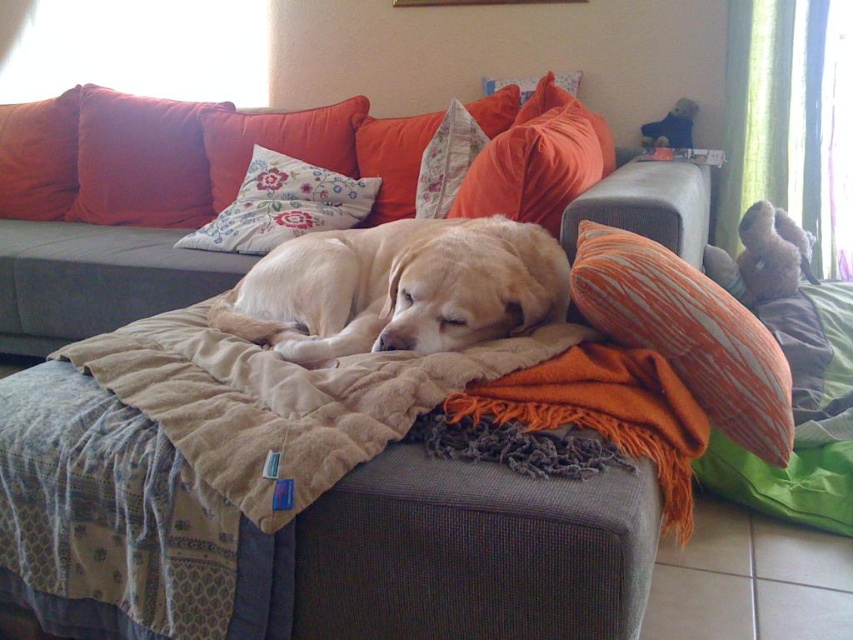
Does beige soft blanket at center have a larger size compared to floral fabric pillow at upper center?

Yes.

Does beige soft blanket at center have a greater width compared to floral fabric pillow at upper center?

Yes.

Is point (206, 403) more distant than point (426, 131)?

No, (206, 403) is closer to viewer.

Find the location of a particular element. The width and height of the screenshot is (853, 640). beige soft blanket at center is located at coordinates (283, 401).

Is floral fabric pillow at upper left behind floral fabric pillow at upper center?

Yes.

Between point (213, 124) and point (379, 204), which one is positioned behind?

Point (213, 124)

You are a GUI agent. You are given a task and a screenshot of the screen. Output one action in this format:
    pyautogui.click(x=<x>, y=<y>)
    Task: Click on the floral fabric pillow at upper left
    This screenshot has height=640, width=853.
    Given the screenshot: What is the action you would take?
    pyautogui.click(x=279, y=141)

Who is shorter, matte orange pillow at upper left or floral fabric pillow at upper left?

Standing shorter between the two is floral fabric pillow at upper left.

Is point (102, 182) less distant than point (344, 100)?

That is False.

I want to click on matte orange pillow at upper left, so click(x=141, y=161).